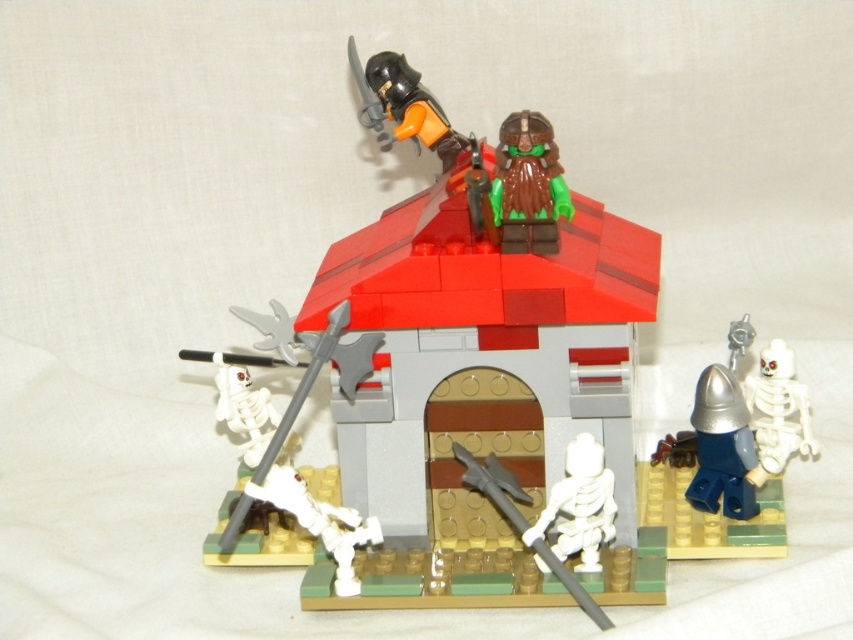
Is matte black helmet at upper center closer to camera compared to green matte helmeted figure at center?

That is False.

I want to click on matte black helmet at upper center, so click(471, 394).

From the picture: Can you confirm if matte black helmet at upper center is positioned to the left of white matte skeleton at right?

Indeed, matte black helmet at upper center is positioned on the left side of white matte skeleton at right.

You are a GUI agent. You are given a task and a screenshot of the screen. Output one action in this format:
    pyautogui.click(x=<x>, y=<y>)
    Task: Click on the matte black helmet at upper center
    
    Given the screenshot: What is the action you would take?
    pyautogui.click(x=471, y=394)

Is green matte helmeted figure at center above white matte skeleton at lower center?

Correct, green matte helmeted figure at center is located above white matte skeleton at lower center.

This screenshot has width=853, height=640. Describe the element at coordinates (527, 186) in the screenshot. I see `green matte helmeted figure at center` at that location.

Identify the location of green matte helmeted figure at center. This screenshot has width=853, height=640. (527, 186).